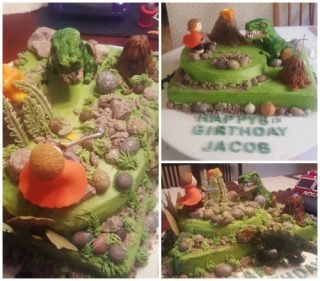
I want to click on birthday cake, so click(306, 141).